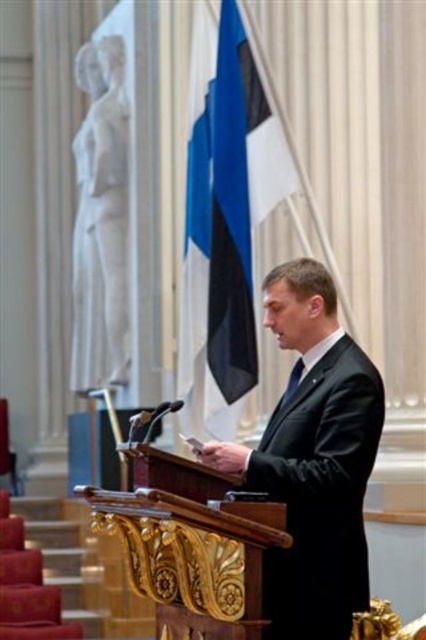
Question: Where is black glossy suit at center located in relation to blue fabric flag at center in the image?

Choices:
 (A) below
 (B) above

Answer: (A)

Question: Among these points, which one is nearest to the camera?

Choices:
 (A) (230, 326)
 (B) (351, 374)

Answer: (B)

Question: In this image, where is blue fabric flag at center located relative to black satin tie at center?

Choices:
 (A) below
 (B) above

Answer: (B)

Question: Can you confirm if black glossy suit at center is bigger than blue fabric flag at center?

Choices:
 (A) no
 (B) yes

Answer: (A)

Question: Which of these objects is positioned closest to the black glossy suit at center?

Choices:
 (A) black satin tie at center
 (B) blue fabric flag at center

Answer: (A)

Question: Estimate the real-world distances between objects in this image. Which object is farther from the blue fabric flag at center?

Choices:
 (A) black satin tie at center
 (B) black glossy suit at center

Answer: (B)